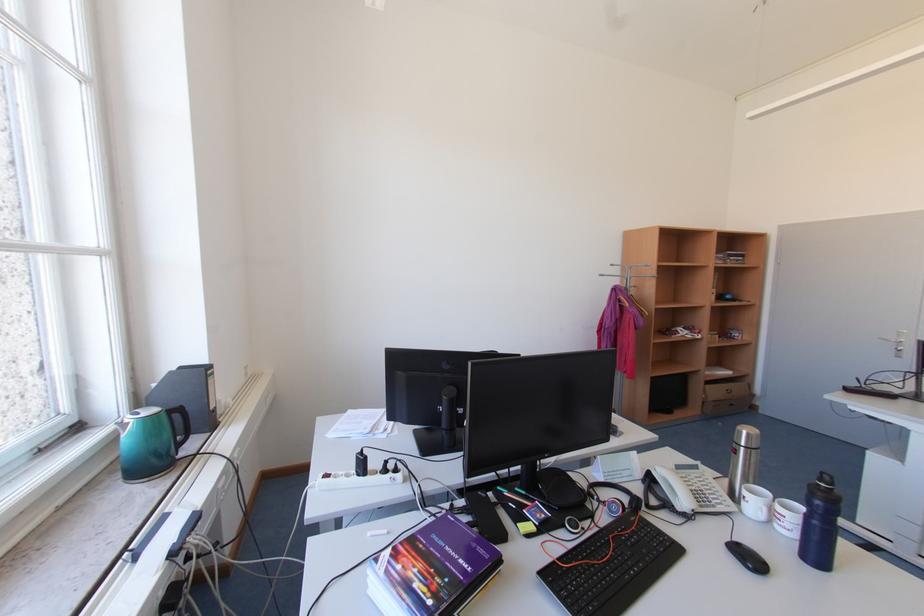
At what (x,y) coordinates should I click in order to perform the action: click on green kettle handle. Please return your answer as a coordinate pair (x, y). Image resolution: width=924 pixels, height=616 pixels. Looking at the image, I should click on (178, 424).